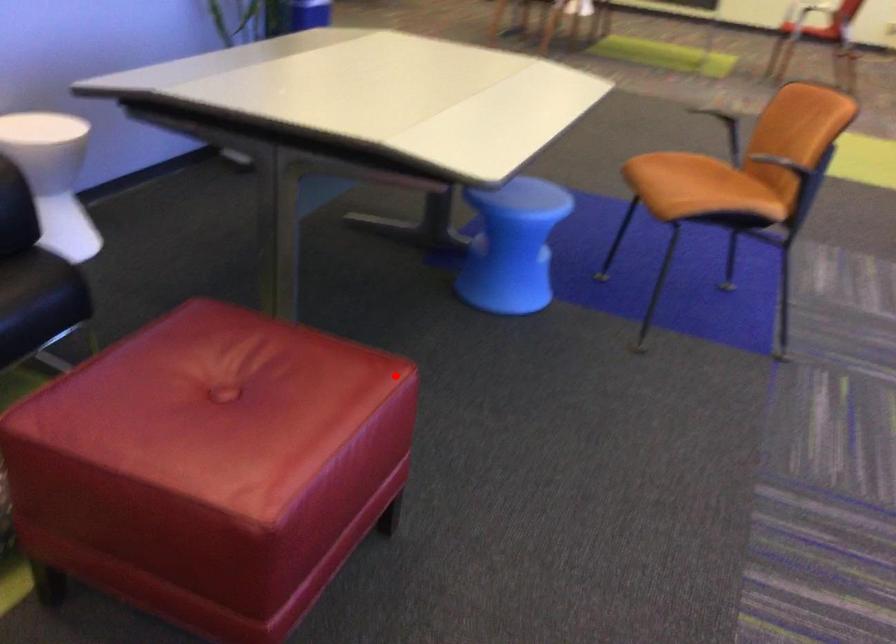
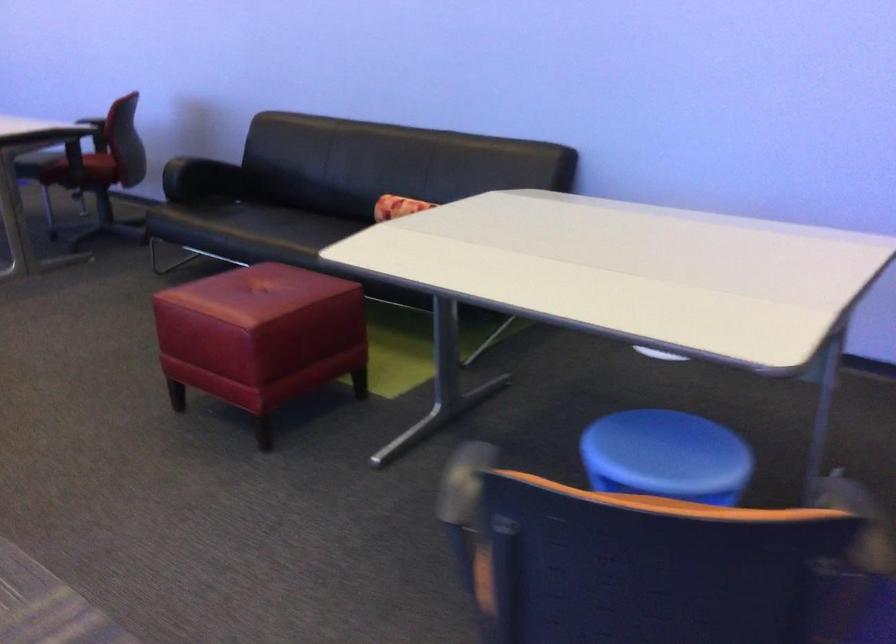
Question: I am providing you with two images of the same scene from different viewpoints. Image1 has a red point marked. In image2, the corresponding 3D location appears at what relative position? Reply with the corresponding letter.

Choices:
 (A) Closer
 (B) Farther

Answer: (B)